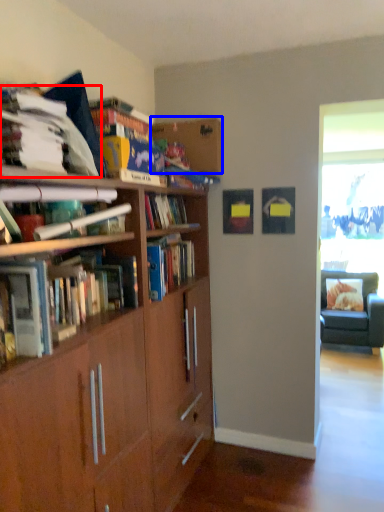
Question: Which of the following is the farthest to the observer, book (highlighted by a red box) or shelf (highlighted by a blue box)?

Choices:
 (A) book
 (B) shelf

Answer: (B)